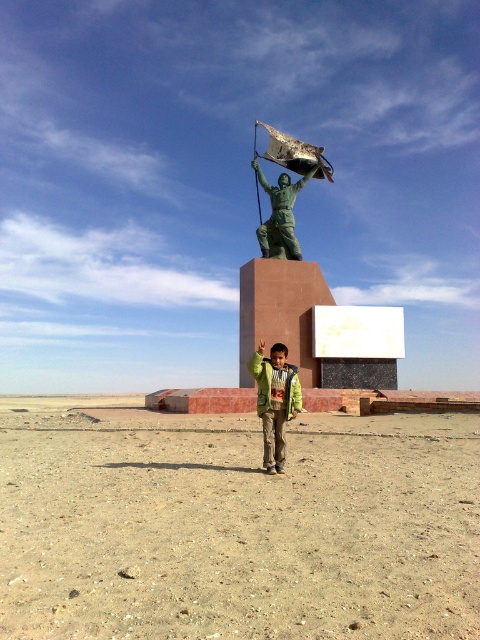
Is bronze statue at center positioned at the back of green matte jacket at center?

Yes, bronze statue at center is further from the viewer.

The image size is (480, 640). Describe the element at coordinates (285, 189) in the screenshot. I see `bronze statue at center` at that location.

Is point (300, 160) positioned in front of point (264, 449)?

No.

This screenshot has height=640, width=480. I want to click on bronze statue at center, so (285, 189).

Between point (180, 548) and point (300, 180), which one is positioned behind?

The point (300, 180) is more distant.

Does point (117, 598) lie behind point (291, 243)?

No, it is not.

What are the coordinates of `dull brown dirt at center` in the screenshot? It's located at (x=235, y=524).

Does point (117, 524) come in front of point (280, 360)?

That is True.

Between dull brown dirt at center and green matte jacket at center, which one is positioned higher?

green matte jacket at center is above.

Which is in front, point (12, 506) or point (256, 365)?

Positioned in front is point (12, 506).

The image size is (480, 640). Identify the location of dull brown dirt at center. (235, 524).